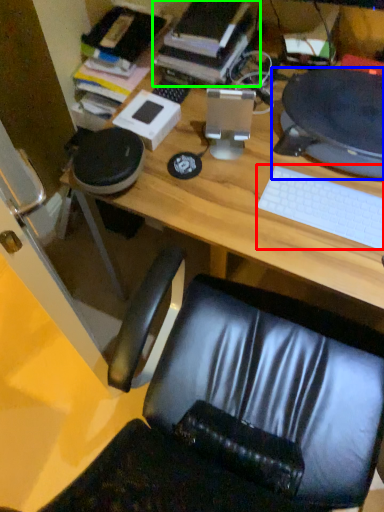
Question: Which is nearer to the keyboard (highlighted by a red box)? desktop computer (highlighted by a blue box) or book (highlighted by a green box).

Choices:
 (A) desktop computer
 (B) book

Answer: (A)